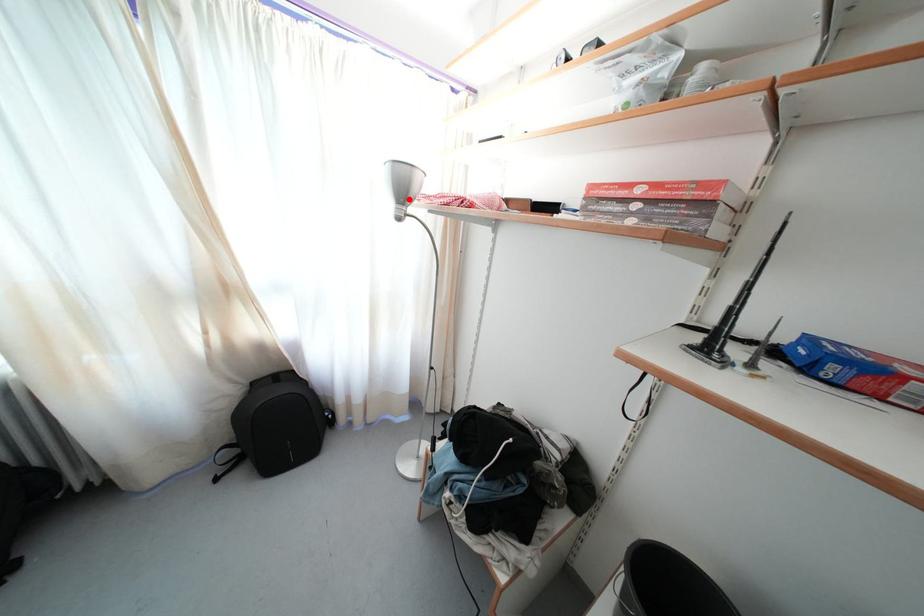
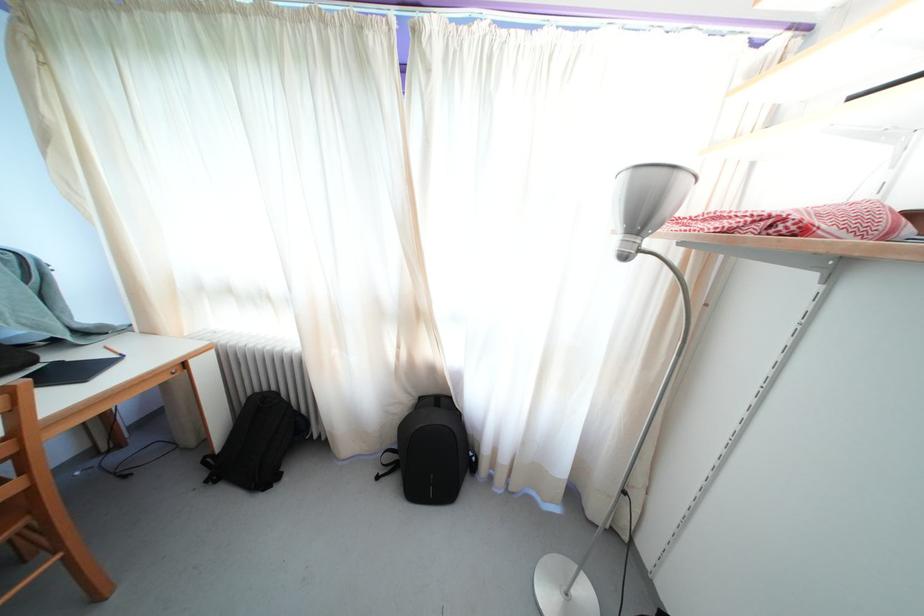
In the second image, find the point that corresponds to the highlighted location in the first image.

(648, 223)